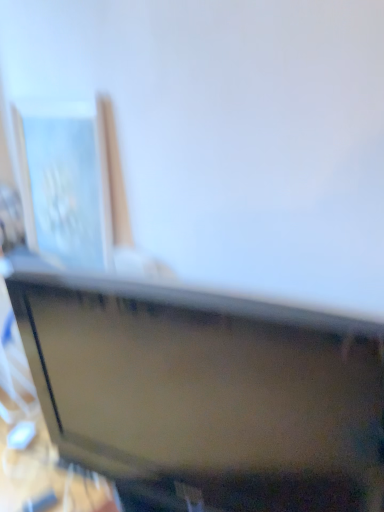
What do you see at coordinates (206, 390) in the screenshot? I see `matte black monitor at center` at bounding box center [206, 390].

Locate an element on the screen. The image size is (384, 512). matte black monitor at center is located at coordinates (206, 390).

Consider the image. What is the approximate width of matte black monitor at center?

It is 6.92 inches.

Where is `matte black monitor at center`? The height and width of the screenshot is (512, 384). matte black monitor at center is located at coordinates (206, 390).